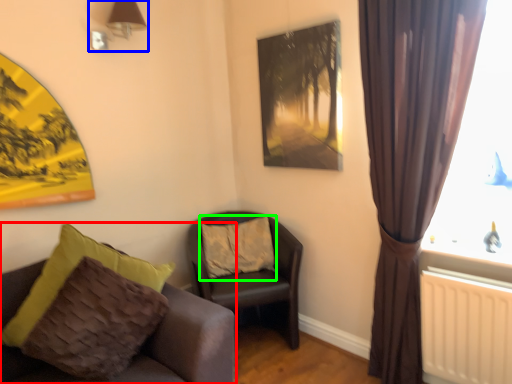
Question: Which object is positioned farthest from chair (highlighted by a red box)? Select from lamp (highlighted by a blue box) and pillow (highlighted by a green box).

Choices:
 (A) lamp
 (B) pillow

Answer: (A)